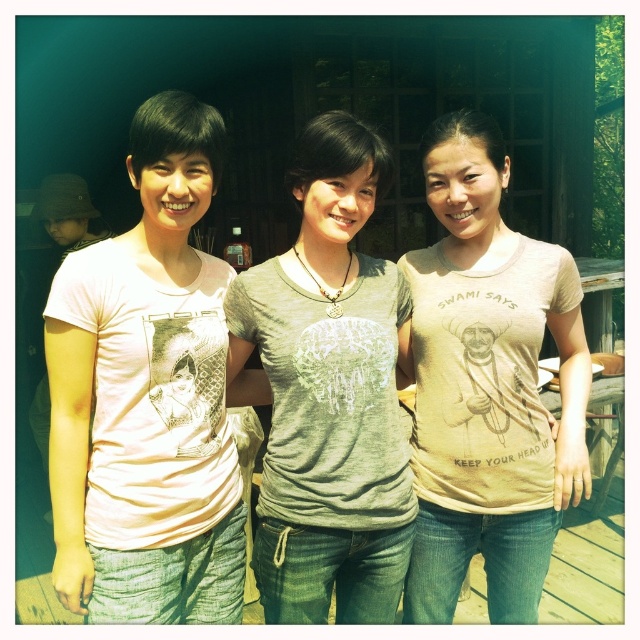
Question: Which of the following is the farthest from the observer?

Choices:
 (A) gray matte t-shirt at center
 (B) matte pink t-shirt at left
 (C) beige cotton t-shirt at center

Answer: (C)

Question: Which of the following is the farthest from the observer?

Choices:
 (A) (144, 259)
 (B) (525, 493)

Answer: (B)

Question: Is matte pink t-shirt at left to the right of beige cotton t-shirt at center from the viewer's perspective?

Choices:
 (A) yes
 (B) no

Answer: (B)

Question: Can you confirm if beige cotton t-shirt at center is positioned below gray matte t-shirt at center?

Choices:
 (A) yes
 (B) no

Answer: (A)

Question: Can you confirm if matte pink t-shirt at left is wider than beige cotton t-shirt at center?

Choices:
 (A) no
 (B) yes

Answer: (A)

Question: Which point is farther to the camera?

Choices:
 (A) (435, 332)
 (B) (268, 372)

Answer: (A)